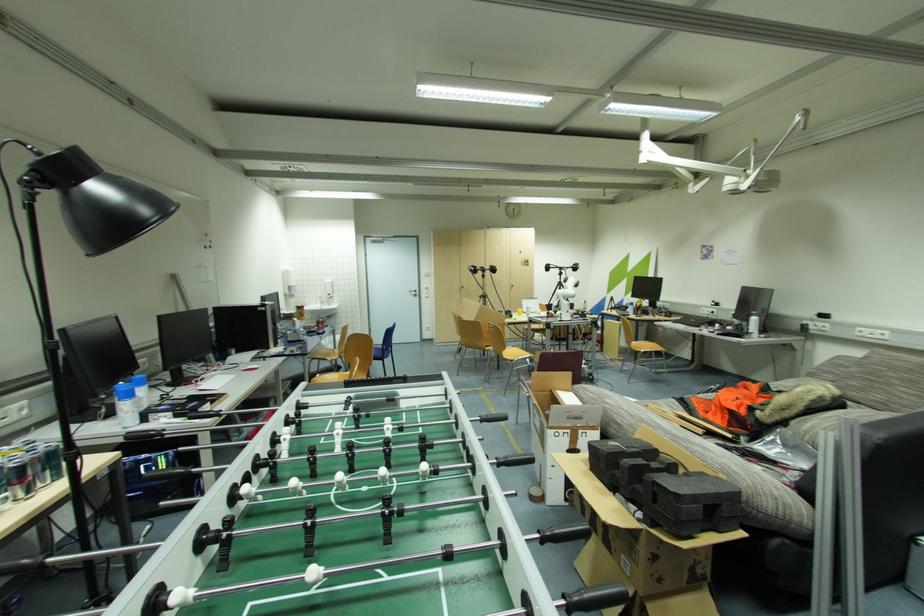
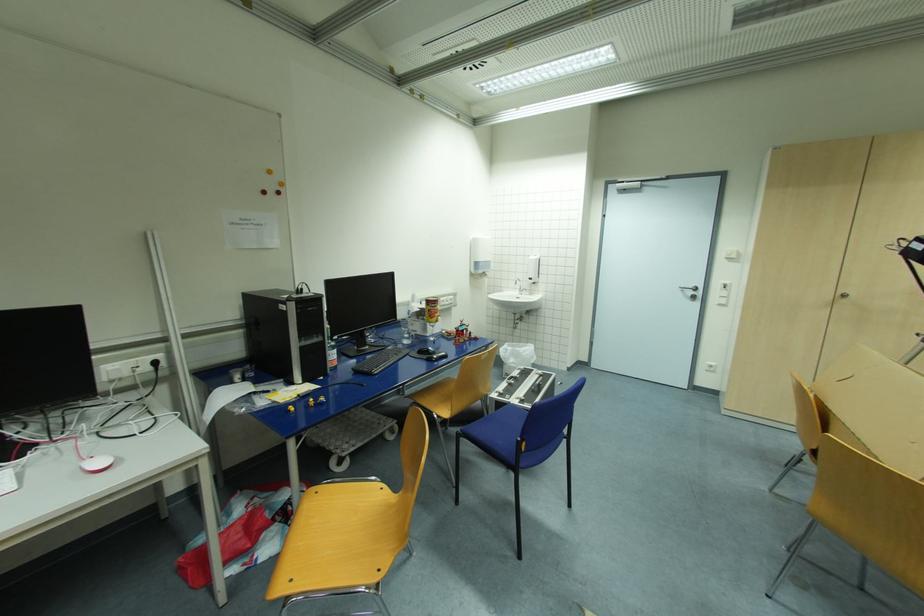
The point at (466, 288) is marked in the first image. Where is the corresponding point in the second image?

(847, 296)